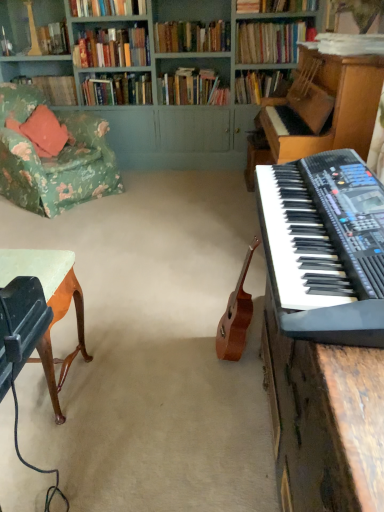
Identify the location of vacant space to the right of light brown wood desk at lower left. (113, 382).